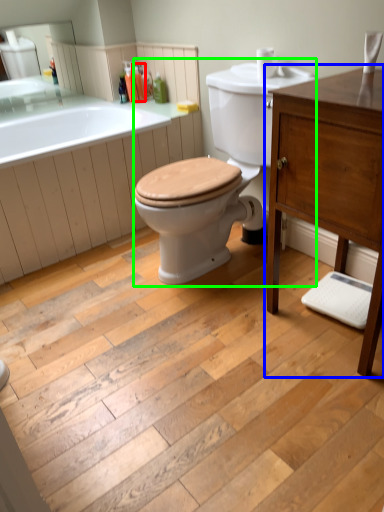
Question: Which object is positioned closest to toiletry (highlighted by a red box)? Select from bathroom cabinet (highlighted by a blue box) and porcelain (highlighted by a green box).

Choices:
 (A) bathroom cabinet
 (B) porcelain

Answer: (B)